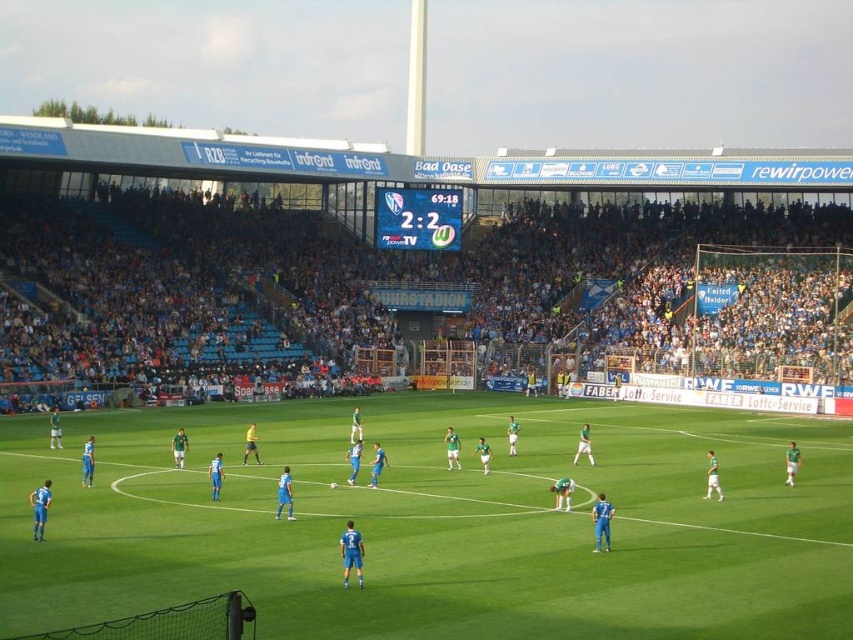
You are a drone operator trying to capture aerial footage of the soccer match. The stadium has a restricted airspace zone that prohibits drones from entering an area above the green grass field at center. Given that your drone is currently at coordinates 0.819, 0.519, are you within the restricted airspace zone?

Yes, the green grass field at center is located at point (442, 524), so your drone is currently within the restricted airspace zone.

From the picture: You are a spectator sitting in the blue plastic seats at upper center. Looking down, you see the green grass field at center. Which direction should you look to see the field?

The green grass field at center is located below the blue plastic seats at upper center, so you should look downward to see it.

You are standing at the center of the soccer field and want to kick the ball to a point that is 25 meters away from where you are standing. Can you reach the point marked as point (3,614) with your kick?

The distance of point (3,614) from camera is 25.08 meters, so yes, you can reach the point marked as point (3,614) with your kick since it is approximately 25 meters away.